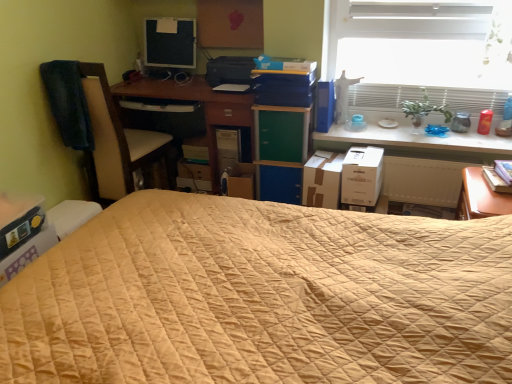
At what (x,y) coordinates should I click in order to perform the action: click on vacant space to the right of blue matte book at upper right, the second paperback book from the right. Please return your answer as a coordinate pair (x, y). Image resolution: width=512 pixels, height=384 pixels. Looking at the image, I should click on (354, 129).